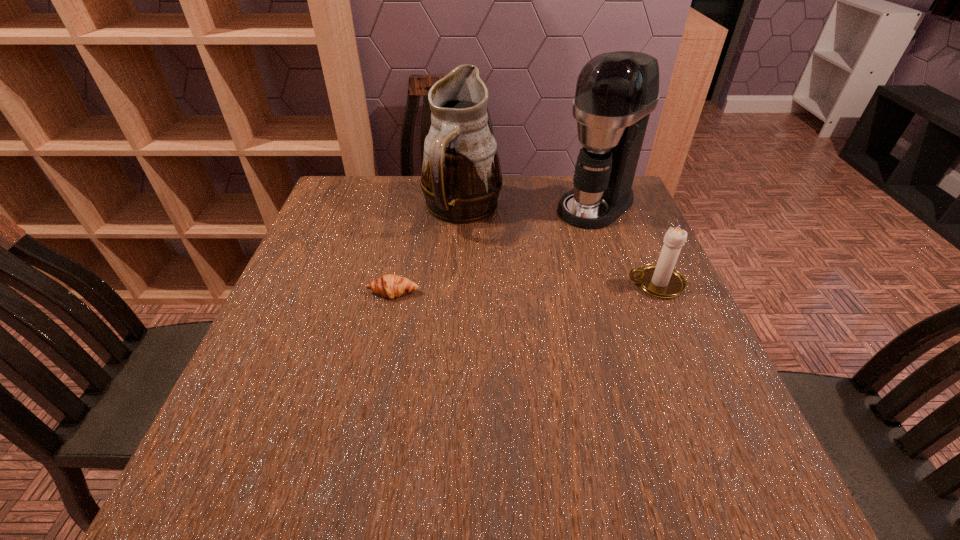
Identify the location of free space on the desktop that is between the pastry and the third tallest object and is positioned from the spout of the pitcher. Image resolution: width=960 pixels, height=540 pixels. (511, 289).

Identify the location of free space on the desktop that is between the shortest object and the second shortest object and is positioned place cup under the spout of the coffee maker. Image resolution: width=960 pixels, height=540 pixels. click(491, 289).